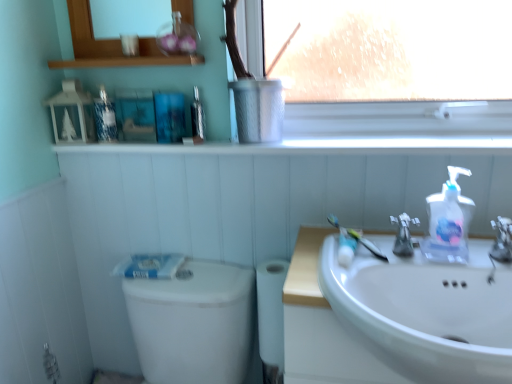
The image size is (512, 384). Identify the location of metallic silver window sill at upper center, the second window sill in the bottom-to-top sequence. (128, 61).

Find the location of `translucent plastic toothbrush at sink`. translucent plastic toothbrush at sink is located at coordinates (356, 237).

Describe the element at coordinates (193, 323) in the screenshot. I see `white glossy toilet bowl at lower left` at that location.

In order to click on metallic silver window sill at upper center, the second window sill in the bottom-to-top sequence in this screenshot , I will do `click(128, 61)`.

Considering the sizes of metallic silver mouthwash at upper center, the second mouthwash from the left, and white matte toilet paper at lower center in the image, is metallic silver mouthwash at upper center, the second mouthwash from the left, taller or shorter than white matte toilet paper at lower center?

metallic silver mouthwash at upper center, the second mouthwash from the left, is shorter than white matte toilet paper at lower center.

Considering the sizes of metallic silver mouthwash at upper center, the second mouthwash from the left, and white matte toilet paper at lower center in the image, is metallic silver mouthwash at upper center, the second mouthwash from the left, bigger or smaller than white matte toilet paper at lower center?

In the image, metallic silver mouthwash at upper center, the second mouthwash from the left, appears to be smaller than white matte toilet paper at lower center.

Which is in front, point (194, 95) or point (277, 291)?

The point (277, 291) is in front.

Is metallic silver mouthwash at upper center, the second mouthwash from the left, positioned beyond the bounds of white matte toilet paper at lower center?

Yes, metallic silver mouthwash at upper center, the second mouthwash from the left, is not within white matte toilet paper at lower center.

From a real-world perspective, does clear glass medicine cabinet at upper center sit lower than white glossy toilet bowl at lower left?

Incorrect, from a real-world perspective, clear glass medicine cabinet at upper center is higher than white glossy toilet bowl at lower left.

Considering the relative positions of clear glass medicine cabinet at upper center and white glossy toilet bowl at lower left in the image provided, is clear glass medicine cabinet at upper center to the left of white glossy toilet bowl at lower left from the viewer's perspective?

Yes.

From the image's perspective, who appears lower, clear glass medicine cabinet at upper center or white glossy toilet bowl at lower left?

white glossy toilet bowl at lower left, from the image's perspective.

Is white glossy toilet bowl at lower left a part of clear glass medicine cabinet at upper center?

No.

Would you say metallic silver mouthwash at upper center, positioned as the first mouthwash in right-to-left order, is part of blue textured bottle at upper left, which is the 1th mouthwash from left to right,'s contents?

No, metallic silver mouthwash at upper center, positioned as the first mouthwash in right-to-left order, is not surrounded by blue textured bottle at upper left, which is the 1th mouthwash from left to right.

From the image's perspective, is blue textured bottle at upper left, which is the 1th mouthwash from left to right, above or below metallic silver mouthwash at upper center, the second mouthwash from the left?

blue textured bottle at upper left, which is the 1th mouthwash from left to right, is above metallic silver mouthwash at upper center, the second mouthwash from the left.

Does blue textured bottle at upper left, placed as the 2th mouthwash when sorted from right to left, turn towards metallic silver mouthwash at upper center, the second mouthwash from the left?

No, blue textured bottle at upper left, placed as the 2th mouthwash when sorted from right to left, is not oriented towards metallic silver mouthwash at upper center, the second mouthwash from the left.

Which object is further away from the camera taking this photo, blue textured bottle at upper left, placed as the 2th mouthwash when sorted from right to left, or metallic silver mouthwash at upper center, the second mouthwash from the left?

metallic silver mouthwash at upper center, the second mouthwash from the left, is more distant.

Is the position of white glossy window sill at upper center, which is the first window sill in bottom-to-top order, more distant than that of translucent plastic toothbrush at sink?

That is True.

Is white glossy window sill at upper center, which is the first window sill in bottom-to-top order, bigger than translucent plastic toothbrush at sink?

Yes, white glossy window sill at upper center, which is the first window sill in bottom-to-top order, is bigger than translucent plastic toothbrush at sink.

How different are the orientations of white glossy window sill at upper center, which is the first window sill in bottom-to-top order, and translucent plastic toothbrush at sink in degrees?

43.4 degrees separate the facing orientations of white glossy window sill at upper center, which is the first window sill in bottom-to-top order, and translucent plastic toothbrush at sink.

Which of these two, white glossy window sill at upper center, which is the first window sill in bottom-to-top order, or translucent plastic toothbrush at sink, stands shorter?

With less height is white glossy window sill at upper center, which is the first window sill in bottom-to-top order.

Is white glossy sink at lower right inside the boundaries of translucent plastic toothbrush at sink, or outside?

white glossy sink at lower right cannot be found inside translucent plastic toothbrush at sink.

Considering the sizes of objects white glossy sink at lower right and translucent plastic toothbrush at sink in the image provided, who is shorter, white glossy sink at lower right or translucent plastic toothbrush at sink?

translucent plastic toothbrush at sink is shorter.

Consider the image. From the image's perspective, is white glossy sink at lower right above or below translucent plastic toothbrush at sink?

From the image's perspective, white glossy sink at lower right appears below translucent plastic toothbrush at sink.

Which is more to the left, white glossy sink at lower right or translucent plastic toothbrush at sink?

Positioned to the left is translucent plastic toothbrush at sink.

Looking at this image, does white matte toilet paper at lower center have a smaller size compared to metallic silver window sill at upper center, the second window sill in the bottom-to-top sequence?

No, white matte toilet paper at lower center is not smaller than metallic silver window sill at upper center, the second window sill in the bottom-to-top sequence.

Measure the distance between white matte toilet paper at lower center and metallic silver window sill at upper center, the second window sill in the bottom-to-top sequence.

They are 29.70 inches apart.

Considering the positions of objects white matte toilet paper at lower center and metallic silver window sill at upper center, the second window sill in the bottom-to-top sequence, in the image provided, who is more to the left, white matte toilet paper at lower center or metallic silver window sill at upper center, the second window sill in the bottom-to-top sequence,?

metallic silver window sill at upper center, the second window sill in the bottom-to-top sequence.

Is white matte toilet paper at lower center oriented towards metallic silver window sill at upper center, the 1th window sill positioned from the top?

No, white matte toilet paper at lower center is not facing towards metallic silver window sill at upper center, the 1th window sill positioned from the top.

Can you confirm if satin nickel faucet at sink right, arranged as the 1th tap when viewed from the left, is bigger than satin nickel faucet at sink right, which ranks as the 1th tap in right-to-left order?

Actually, satin nickel faucet at sink right, arranged as the 1th tap when viewed from the left, might be smaller than satin nickel faucet at sink right, which ranks as the 1th tap in right-to-left order.

Identify the location of tap located underneath the satin nickel faucet at sink right, which ranks as the 2th tap in left-to-right order (from a real-world perspective). This screenshot has height=384, width=512. (403, 235).

From the picture: Is satin nickel faucet at sink right, arranged as the 1th tap when viewed from the left, far from satin nickel faucet at sink right, which ranks as the 2th tap in left-to-right order?

They are positioned close to each other.

From the image's perspective, is satin nickel faucet at sink right, arranged as the 1th tap when viewed from the left, positioned above or below satin nickel faucet at sink right, which ranks as the 2th tap in left-to-right order?

Clearly, from the image's perspective, satin nickel faucet at sink right, arranged as the 1th tap when viewed from the left, is above satin nickel faucet at sink right, which ranks as the 2th tap in left-to-right order.

You are a GUI agent. You are given a task and a screenshot of the screen. Output one action in this format:
    pyautogui.click(x=<x>, y=<y>)
    Task: Click on the toilet paper in front of the metallic silver mouthwash at upper center, the second mouthwash from the left
    
    Given the screenshot: What is the action you would take?
    pyautogui.click(x=271, y=318)

Where is `medicine cabinet above the white glossy toilet bowl at lower left (from a real-world perspective)`? The height and width of the screenshot is (384, 512). medicine cabinet above the white glossy toilet bowl at lower left (from a real-world perspective) is located at coordinates (111, 46).

From the image, which object appears to be nearer to translucent plastic toothbrush at sink, metallic silver window sill at upper center, the second window sill in the bottom-to-top sequence, or clear plastic soap dispenser at right?

The object closer to translucent plastic toothbrush at sink is clear plastic soap dispenser at right.

Estimate the real-world distances between objects in this image. Which object is further from translucent plastic toothbrush at sink, metallic silver window sill at upper center, the 1th window sill positioned from the top, or white glossy sink at lower right?

Based on the image, metallic silver window sill at upper center, the 1th window sill positioned from the top, appears to be further to translucent plastic toothbrush at sink.

From the image, which object appears to be nearer to clear glass medicine cabinet at upper center, metallic silver window sill at upper center, the 1th window sill positioned from the top, or white matte toilet paper at lower center?

metallic silver window sill at upper center, the 1th window sill positioned from the top, is closer to clear glass medicine cabinet at upper center.

Based on the photo, based on their spatial positions, is metallic silver window sill at upper center, the 1th window sill positioned from the top, or translucent plastic toothbrush at sink further from white glossy toilet bowl at lower left?

The object further to white glossy toilet bowl at lower left is metallic silver window sill at upper center, the 1th window sill positioned from the top.

Considering their positions, is satin nickel faucet at sink right, the 2th tap viewed from the right, positioned closer to clear glass medicine cabinet at upper center than translucent plastic toothbrush at sink?

translucent plastic toothbrush at sink is positioned closer to the anchor clear glass medicine cabinet at upper center.

Based on their spatial positions, is white matte toilet paper at lower center or clear glass medicine cabinet at upper center further from metallic silver window sill at upper center, the 1th window sill positioned from the top?

white matte toilet paper at lower center is further to metallic silver window sill at upper center, the 1th window sill positioned from the top.

When comparing their distances from metallic silver window sill at upper center, the 1th window sill positioned from the top, does satin nickel faucet at sink right, which ranks as the 2th tap in left-to-right order, or white glossy sink at lower right seem closer?

white glossy sink at lower right.

Considering their positions, is white glossy window sill at upper center, which is the first window sill in bottom-to-top order, positioned further to clear glass medicine cabinet at upper center than satin nickel faucet at sink right, which ranks as the 2th tap in left-to-right order?

satin nickel faucet at sink right, which ranks as the 2th tap in left-to-right order, lies further to clear glass medicine cabinet at upper center than the other object.

The width and height of the screenshot is (512, 384). Find the location of `window sill between metallic silver mouthwash at upper center, the second mouthwash from the left, and translucent plastic toothbrush at sink from left to right`. window sill between metallic silver mouthwash at upper center, the second mouthwash from the left, and translucent plastic toothbrush at sink from left to right is located at coordinates (316, 146).

Locate an element on the screen. This screenshot has width=512, height=384. mouthwash between clear glass medicine cabinet at upper center and white glossy window sill at upper center, which is the first window sill in bottom-to-top order is located at coordinates (197, 117).

Where is `tap between white glossy toilet bowl at lower left and clear plastic soap dispenser at right in the horizontal direction`? This screenshot has width=512, height=384. tap between white glossy toilet bowl at lower left and clear plastic soap dispenser at right in the horizontal direction is located at coordinates (403, 235).

This screenshot has height=384, width=512. Identify the location of window sill between white glossy sink at lower right and white matte toilet paper at lower center along the z-axis. (316, 146).